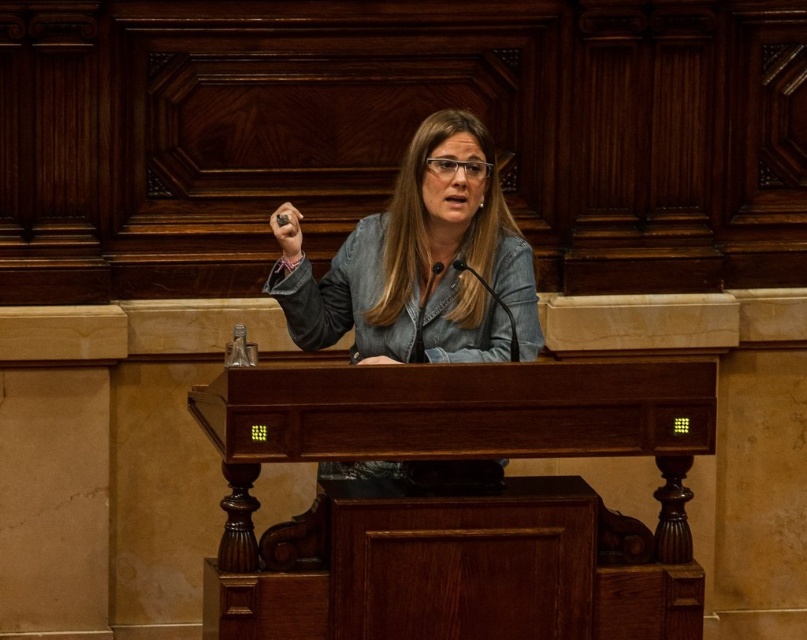
Who is taller, denim jacket at center or black plastic microphone at center?

Standing taller between the two is denim jacket at center.

Is denim jacket at center above black plastic microphone at center?

Indeed, denim jacket at center is positioned over black plastic microphone at center.

Is point (404, 273) farther from camera compared to point (479, 275)?

Yes, it is.

Where is `denim jacket at center`? This screenshot has height=640, width=807. denim jacket at center is located at coordinates (419, 260).

Does point (654, 632) come behind point (492, 234)?

No, it is not.

Is wooden podium at center smaller than denim jacket at center?

Incorrect, wooden podium at center is not smaller in size than denim jacket at center.

What are the coordinates of `wooden podium at center` in the screenshot? It's located at (456, 502).

Between wooden podium at center and black plastic microphone at center, which one appears on the left side from the viewer's perspective?

From the viewer's perspective, wooden podium at center appears more on the left side.

Can you confirm if wooden podium at center is positioned to the left of black plastic microphone at center?

Indeed, wooden podium at center is positioned on the left side of black plastic microphone at center.

Does point (299, 627) come closer to viewer compared to point (513, 346)?

Yes, point (299, 627) is in front of point (513, 346).

What are the coordinates of `wooden podium at center` in the screenshot? It's located at (456, 502).